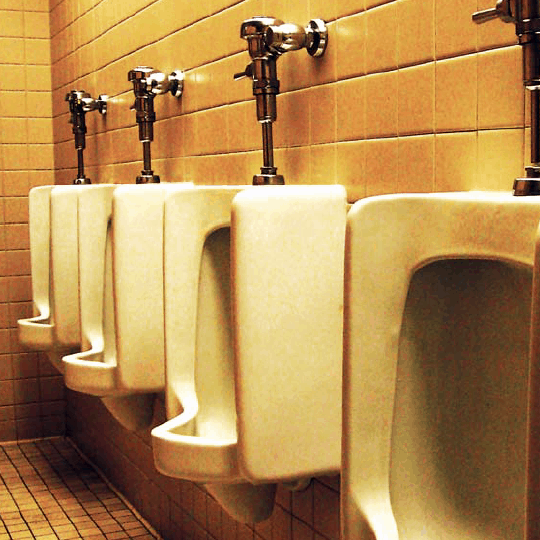
Image resolution: width=540 pixels, height=540 pixels. I want to click on restroom, so click(x=57, y=221), click(x=118, y=262), click(x=256, y=288), click(x=381, y=246).